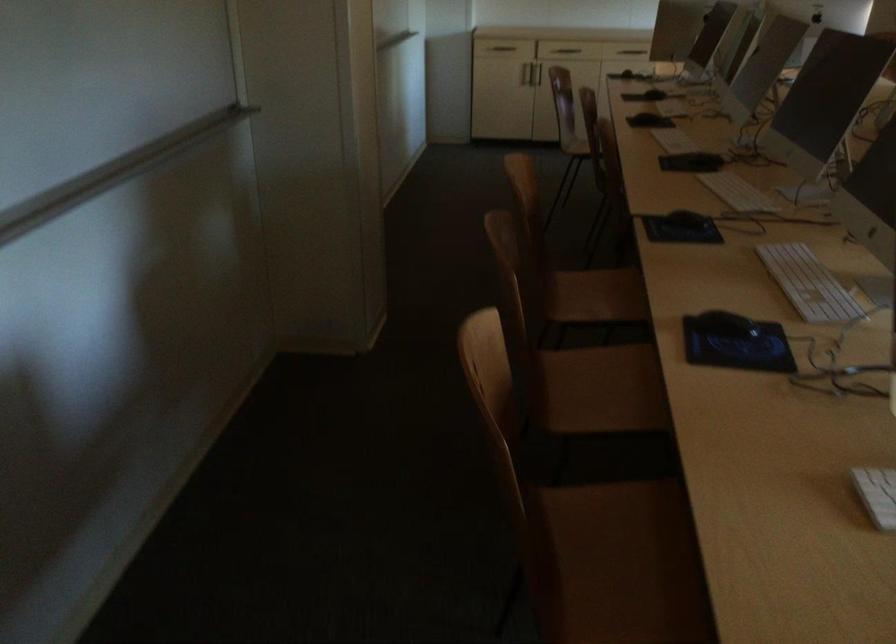
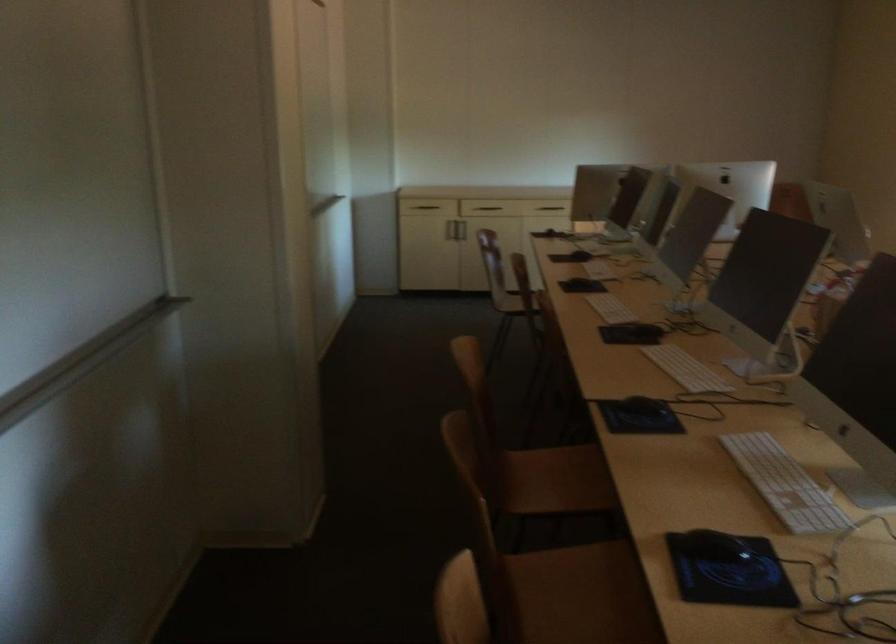
Where in the second image is the point corresponding to (691,158) from the first image?

(631, 330)